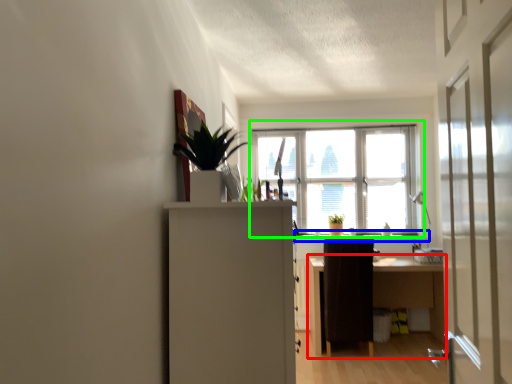
Question: Estimate the real-world distances between objects in this image. Which object is farther from desk (highlighted by a red box), window sill (highlighted by a blue box) or window (highlighted by a green box)?

Choices:
 (A) window sill
 (B) window

Answer: (B)